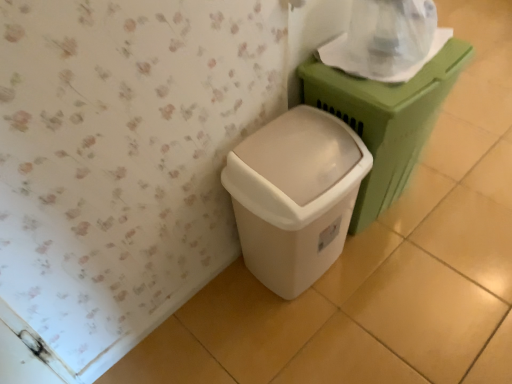
Describe the element at coordinates (295, 196) in the screenshot. This screenshot has width=512, height=384. I see `white plastic waste container at lower center, the second waste container viewed from the right` at that location.

Where is `matte green plastic at right, positioned as the 1th waste container in right-to-left order`? Image resolution: width=512 pixels, height=384 pixels. matte green plastic at right, positioned as the 1th waste container in right-to-left order is located at coordinates click(x=386, y=118).

What are the coordinates of `waste container that is the 2nd object located below the transparent plastic toilet paper at upper right (from the image's perspective)` in the screenshot? It's located at (295, 196).

Considering the sizes of objects white plastic waste container at lower center, the second waste container viewed from the right, and transparent plastic toilet paper at upper right in the image provided, who is wider, white plastic waste container at lower center, the second waste container viewed from the right, or transparent plastic toilet paper at upper right?

white plastic waste container at lower center, the second waste container viewed from the right, is wider.

Is white plastic waste container at lower center, the second waste container viewed from the right, oriented away from transparent plastic toilet paper at upper right?

No, white plastic waste container at lower center, the second waste container viewed from the right, is not facing the opposite direction of transparent plastic toilet paper at upper right.

Is white plastic waste container at lower center, the second waste container viewed from the right, taller than transparent plastic toilet paper at upper right?

Yes, white plastic waste container at lower center, the second waste container viewed from the right, is taller than transparent plastic toilet paper at upper right.

How far apart are white plastic waste container at lower center, the second waste container viewed from the right, and matte green plastic at right, positioned as the 1th waste container in right-to-left order?

The distance of white plastic waste container at lower center, the second waste container viewed from the right, from matte green plastic at right, positioned as the 1th waste container in right-to-left order, is 8.07 inches.

Is white plastic waste container at lower center, the second waste container viewed from the right, positioned behind matte green plastic at right, positioned as the 1th waste container in right-to-left order?

No, the depth of white plastic waste container at lower center, the second waste container viewed from the right, is less than that of matte green plastic at right, positioned as the 1th waste container in right-to-left order.

Is white plastic waste container at lower center, the second waste container viewed from the right, spatially inside matte green plastic at right, the 2th waste container from the left, or outside of it?

white plastic waste container at lower center, the second waste container viewed from the right, is outside matte green plastic at right, the 2th waste container from the left.

In terms of height, does white plastic waste container at lower center, arranged as the first waste container when viewed from the left, look taller or shorter compared to matte green plastic at right, positioned as the 1th waste container in right-to-left order?

Considering their sizes, white plastic waste container at lower center, arranged as the first waste container when viewed from the left, has less height than matte green plastic at right, positioned as the 1th waste container in right-to-left order.

From a real-world perspective, which object rests below the other?

white plastic waste container at lower center, arranged as the first waste container when viewed from the left, from a real-world perspective.

From the image's perspective, is matte green plastic at right, the 2th waste container from the left, over white plastic waste container at lower center, arranged as the first waste container when viewed from the left?

Correct, matte green plastic at right, the 2th waste container from the left, appears higher than white plastic waste container at lower center, arranged as the first waste container when viewed from the left, in the image.

Can you see matte green plastic at right, the 2th waste container from the left, touching white plastic waste container at lower center, the second waste container viewed from the right?

matte green plastic at right, the 2th waste container from the left, and white plastic waste container at lower center, the second waste container viewed from the right, are not in contact.

Is transparent plastic toilet paper at upper right positioned in front of white plastic waste container at lower center, arranged as the first waste container when viewed from the left?

No, transparent plastic toilet paper at upper right is further to the viewer.

From a real-world perspective, between transparent plastic toilet paper at upper right and white plastic waste container at lower center, the second waste container viewed from the right, who is vertically lower?

white plastic waste container at lower center, the second waste container viewed from the right, is physically lower.

Would you say transparent plastic toilet paper at upper right is inside or outside white plastic waste container at lower center, the second waste container viewed from the right?

transparent plastic toilet paper at upper right is spatially situated outside white plastic waste container at lower center, the second waste container viewed from the right.

Considering the relative sizes of matte green plastic at right, positioned as the 1th waste container in right-to-left order, and transparent plastic toilet paper at upper right in the image provided, is matte green plastic at right, positioned as the 1th waste container in right-to-left order, wider than transparent plastic toilet paper at upper right?

Yes, matte green plastic at right, positioned as the 1th waste container in right-to-left order, is wider than transparent plastic toilet paper at upper right.

Considering the positions of objects matte green plastic at right, positioned as the 1th waste container in right-to-left order, and transparent plastic toilet paper at upper right in the image provided, who is more to the right, matte green plastic at right, positioned as the 1th waste container in right-to-left order, or transparent plastic toilet paper at upper right?

Positioned to the right is matte green plastic at right, positioned as the 1th waste container in right-to-left order.

From the image's perspective, relative to transparent plastic toilet paper at upper right, is matte green plastic at right, positioned as the 1th waste container in right-to-left order, above or below?

matte green plastic at right, positioned as the 1th waste container in right-to-left order, is situated lower than transparent plastic toilet paper at upper right in the image.

Is matte green plastic at right, the 2th waste container from the left, located outside transparent plastic toilet paper at upper right?

Yes, matte green plastic at right, the 2th waste container from the left, is located beyond the bounds of transparent plastic toilet paper at upper right.

Where is `toilet paper lying above the matte green plastic at right, the 2th waste container from the left (from the image's perspective)`? toilet paper lying above the matte green plastic at right, the 2th waste container from the left (from the image's perspective) is located at coordinates (387, 40).

From the image's perspective, between transparent plastic toilet paper at upper right and matte green plastic at right, positioned as the 1th waste container in right-to-left order, which one is located above?

From the image's view, transparent plastic toilet paper at upper right is above.

Based on the photo, looking at their sizes, would you say transparent plastic toilet paper at upper right is wider or thinner than matte green plastic at right, the 2th waste container from the left?

Clearly, transparent plastic toilet paper at upper right has less width compared to matte green plastic at right, the 2th waste container from the left.

Does transparent plastic toilet paper at upper right have a smaller size compared to matte green plastic at right, the 2th waste container from the left?

Yes.

The height and width of the screenshot is (384, 512). In order to click on the 2nd waste container in front when counting from the transparent plastic toilet paper at upper right in this screenshot , I will do `click(295, 196)`.

The height and width of the screenshot is (384, 512). I want to click on waste container beneath the matte green plastic at right, positioned as the 1th waste container in right-to-left order (from a real-world perspective), so click(295, 196).

Consider the image. Estimate the real-world distances between objects in this image. Which object is further from matte green plastic at right, positioned as the 1th waste container in right-to-left order, white plastic waste container at lower center, the second waste container viewed from the right, or transparent plastic toilet paper at upper right?

white plastic waste container at lower center, the second waste container viewed from the right, is further to matte green plastic at right, positioned as the 1th waste container in right-to-left order.

From the image, which object appears to be farther from transparent plastic toilet paper at upper right, matte green plastic at right, positioned as the 1th waste container in right-to-left order, or white plastic waste container at lower center, arranged as the first waste container when viewed from the left?

The object further to transparent plastic toilet paper at upper right is white plastic waste container at lower center, arranged as the first waste container when viewed from the left.

Considering their positions, is transparent plastic toilet paper at upper right positioned closer to white plastic waste container at lower center, arranged as the first waste container when viewed from the left, than matte green plastic at right, positioned as the 1th waste container in right-to-left order?

The object closer to white plastic waste container at lower center, arranged as the first waste container when viewed from the left, is matte green plastic at right, positioned as the 1th waste container in right-to-left order.

Estimate the real-world distances between objects in this image. Which object is further from matte green plastic at right, positioned as the 1th waste container in right-to-left order, transparent plastic toilet paper at upper right or white plastic waste container at lower center, the second waste container viewed from the right?

white plastic waste container at lower center, the second waste container viewed from the right, lies further to matte green plastic at right, positioned as the 1th waste container in right-to-left order, than the other object.

Considering their positions, is white plastic waste container at lower center, arranged as the first waste container when viewed from the left, positioned further to transparent plastic toilet paper at upper right than matte green plastic at right, the 2th waste container from the left?

white plastic waste container at lower center, arranged as the first waste container when viewed from the left, is further to transparent plastic toilet paper at upper right.

Estimate the real-world distances between objects in this image. Which object is further from white plastic waste container at lower center, arranged as the first waste container when viewed from the left, matte green plastic at right, the 2th waste container from the left, or transparent plastic toilet paper at upper right?

transparent plastic toilet paper at upper right is further to white plastic waste container at lower center, arranged as the first waste container when viewed from the left.

Where is `waste container between transparent plastic toilet paper at upper right and white plastic waste container at lower center, the second waste container viewed from the right, vertically`? waste container between transparent plastic toilet paper at upper right and white plastic waste container at lower center, the second waste container viewed from the right, vertically is located at coordinates (386, 118).